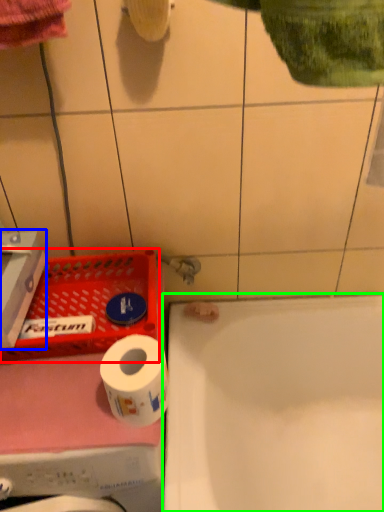
Question: Which object is positioned farthest from laundry basket (highlighted by a red box)? Select from carton (highlighted by a blue box) and bathtub (highlighted by a green box).

Choices:
 (A) carton
 (B) bathtub

Answer: (B)